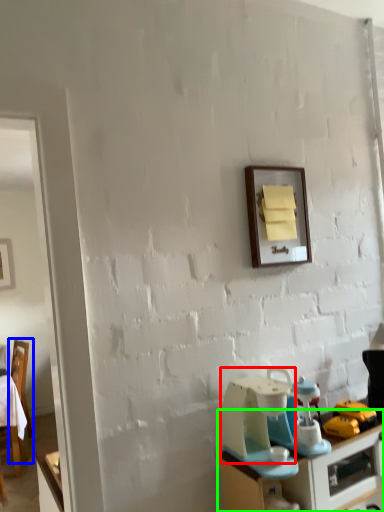
Question: Based on their relative distances, which object is farther from appliance (highlighted by a red box)? Choose from chair (highlighted by a blue box) and desk (highlighted by a green box).

Choices:
 (A) chair
 (B) desk

Answer: (A)